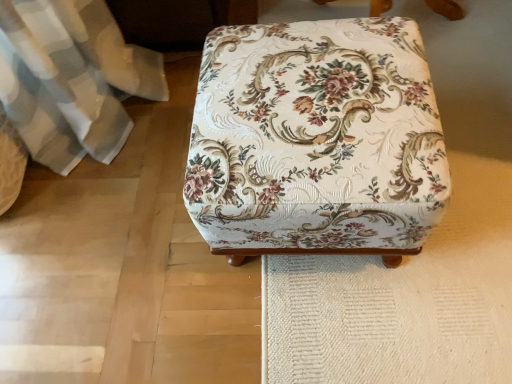
Image resolution: width=512 pixels, height=384 pixels. What are the coordinates of `free location above floral fabric ottoman at center (from a real-world perspective)` in the screenshot? It's located at point(329,112).